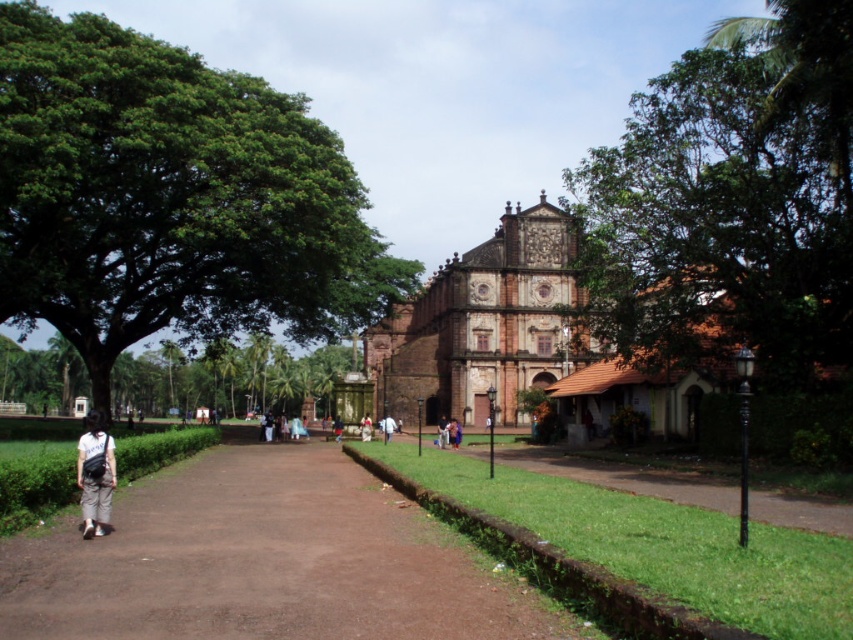
You are a tourist standing at the entrance of the historic building and want to place your light beige fabric bag at lower left on the ground. Where should you place it so that it doesn not block the brown dirt path at center?

The light beige fabric bag at lower left should be placed above the brown dirt path at center since the path is located below the bag.

You are a visitor approaching the historic building and notice two green leafy trees. One is labeled as the green leafy tree at left and the other as the green leafy tree at lower left. Which of these two trees is bigger in size?

The green leafy tree at left is larger in size compared to the green leafy tree at lower left.

You are a tour guide leading a group to the historic building. You notice the light beige fabric bag at lower left lying on the ground. If you want to retrieve it without leaving the path, can you reach it while staying on the brown dirt path at center?

The distance between the brown dirt path at center and the light beige fabric bag at lower left is 60.67 feet. Since you must stay on the path, you cannot physically reach the bag from the path, so you would need to step off the path to retrieve it.